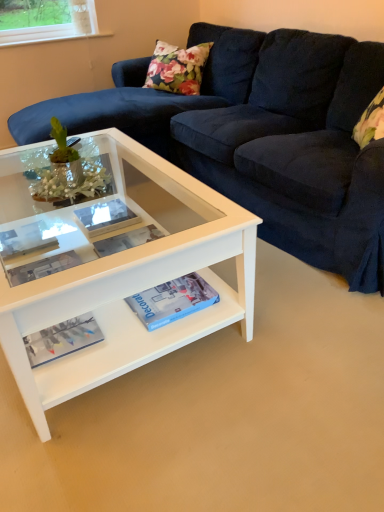
Question: Is velvet dark blue couch at center closer to the viewer compared to matte blue magazine at lower left?

Choices:
 (A) no
 (B) yes

Answer: (B)

Question: Can you confirm if velvet dark blue couch at center is wider than matte blue magazine at lower left?

Choices:
 (A) yes
 (B) no

Answer: (A)

Question: Can you confirm if velvet dark blue couch at center is bigger than matte blue magazine at lower left?

Choices:
 (A) yes
 (B) no

Answer: (A)

Question: Can we say velvet dark blue couch at center lies outside matte blue magazine at lower left?

Choices:
 (A) no
 (B) yes

Answer: (B)

Question: From a real-world perspective, is velvet dark blue couch at center located higher than matte blue magazine at lower left?

Choices:
 (A) no
 (B) yes

Answer: (B)

Question: Could you tell me if velvet dark blue couch at center is turned towards matte blue magazine at lower left?

Choices:
 (A) no
 (B) yes

Answer: (B)

Question: Is white glossy coffee table at center at the left side of matte blue magazine at lower left?

Choices:
 (A) yes
 (B) no

Answer: (B)

Question: Is white glossy coffee table at center located outside matte blue magazine at lower left?

Choices:
 (A) yes
 (B) no

Answer: (A)

Question: Can you confirm if white glossy coffee table at center is smaller than matte blue magazine at lower left?

Choices:
 (A) no
 (B) yes

Answer: (A)

Question: Is white glossy coffee table at center taller than matte blue magazine at lower left?

Choices:
 (A) no
 (B) yes

Answer: (B)

Question: Is white glossy coffee table at center wider than matte blue magazine at lower left?

Choices:
 (A) no
 (B) yes

Answer: (B)

Question: Is white glossy coffee table at center further to the viewer compared to matte blue magazine at lower left?

Choices:
 (A) no
 (B) yes

Answer: (A)

Question: Is matte white book at center not close to matte white paperback book at center, placed as the second paperback book when sorted from right to left?

Choices:
 (A) no
 (B) yes

Answer: (A)